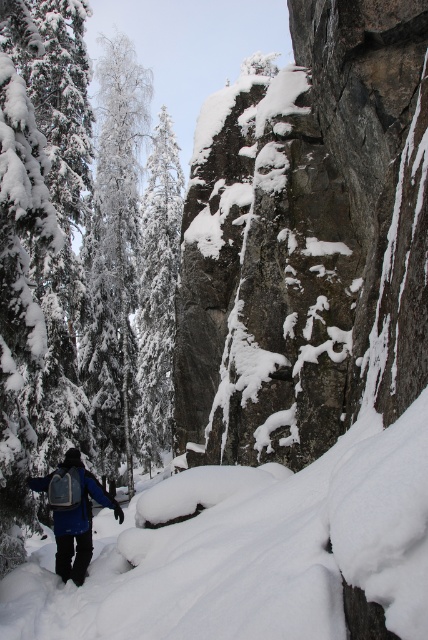
Who is shorter, white snow-covered tree at left or blue fabric backpack at lower left?

blue fabric backpack at lower left is shorter.

Is point (109, 134) positioned behind point (59, 570)?

That is True.

Image resolution: width=428 pixels, height=640 pixels. What are the coordinates of `white snow-covered tree at left` in the screenshot? It's located at [113, 259].

Is white snow-covered tree at center below blue fabric backpack at lower left?

Actually, white snow-covered tree at center is above blue fabric backpack at lower left.

Can you confirm if white snow-covered tree at center is positioned to the right of blue fabric backpack at lower left?

Incorrect, white snow-covered tree at center is not on the right side of blue fabric backpack at lower left.

Describe the element at coordinates (157, 294) in the screenshot. I see `white snow-covered tree at center` at that location.

Identify the location of white snow-covered tree at center. This screenshot has width=428, height=640. (157, 294).

Does white snow-covered tree at left have a greater width compared to white snow-covered tree at center?

Correct, the width of white snow-covered tree at left exceeds that of white snow-covered tree at center.

Is point (112, 45) positioned behind point (145, 352)?

Yes.

The height and width of the screenshot is (640, 428). What are the coordinates of `white snow-covered tree at left` in the screenshot? It's located at (113, 259).